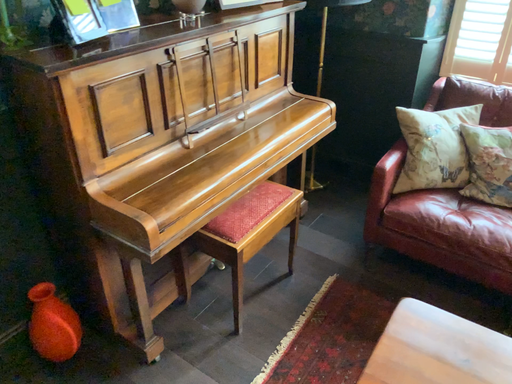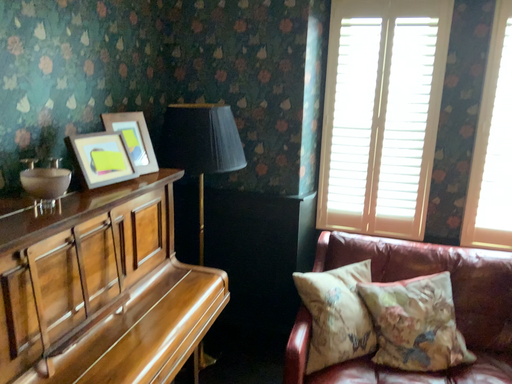
Question: How did the camera likely rotate when shooting the video?

Choices:
 (A) rotated downward
 (B) rotated upward

Answer: (B)